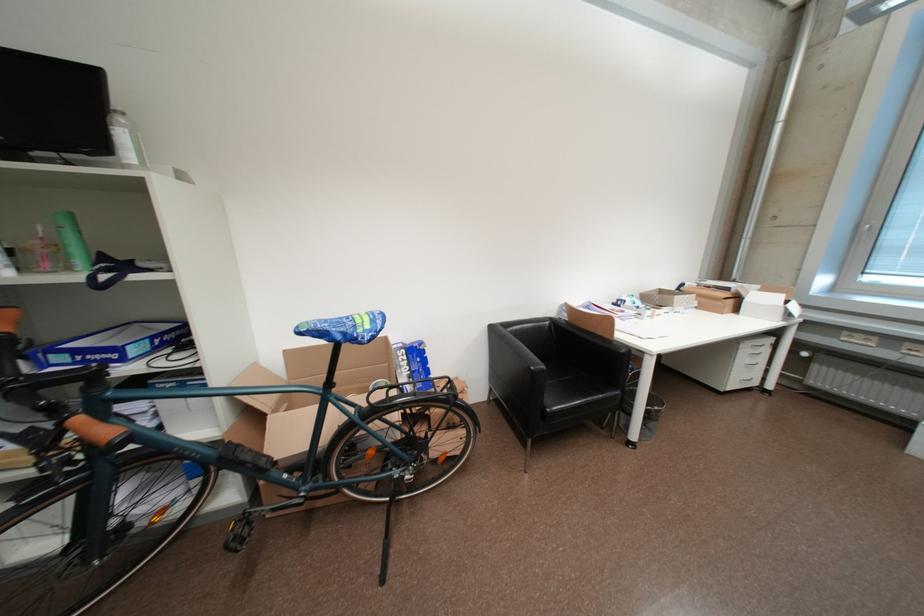
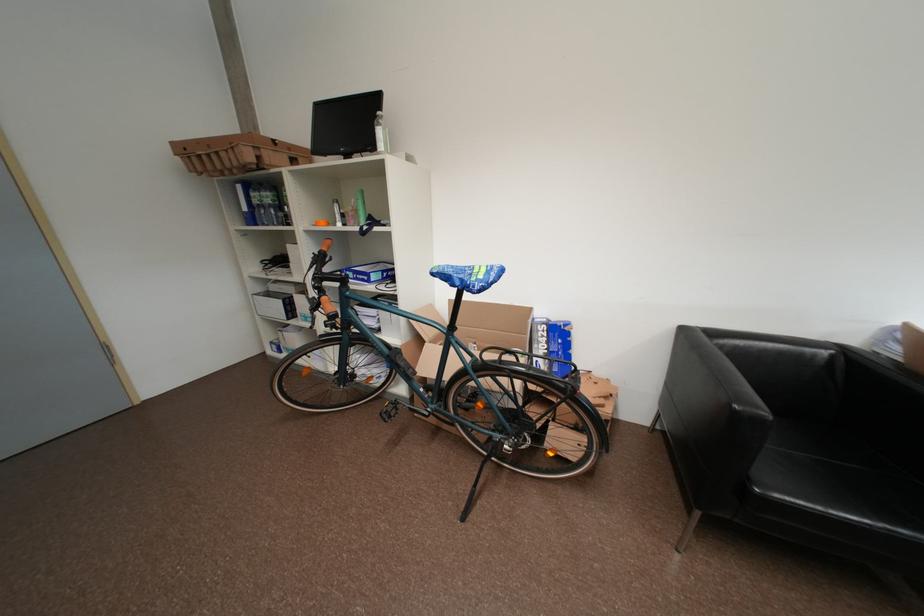
Find the pixel in the second image that matches the point at 375,329 in the first image.

(489, 278)